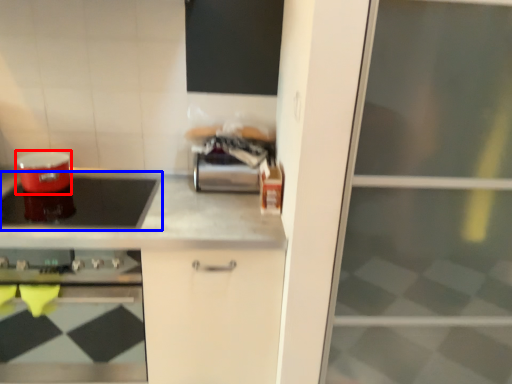
Question: Which object is closer to the camera taking this photo, appliance (highlighted by a red box) or kitchen appliance (highlighted by a blue box)?

Choices:
 (A) appliance
 (B) kitchen appliance

Answer: (B)